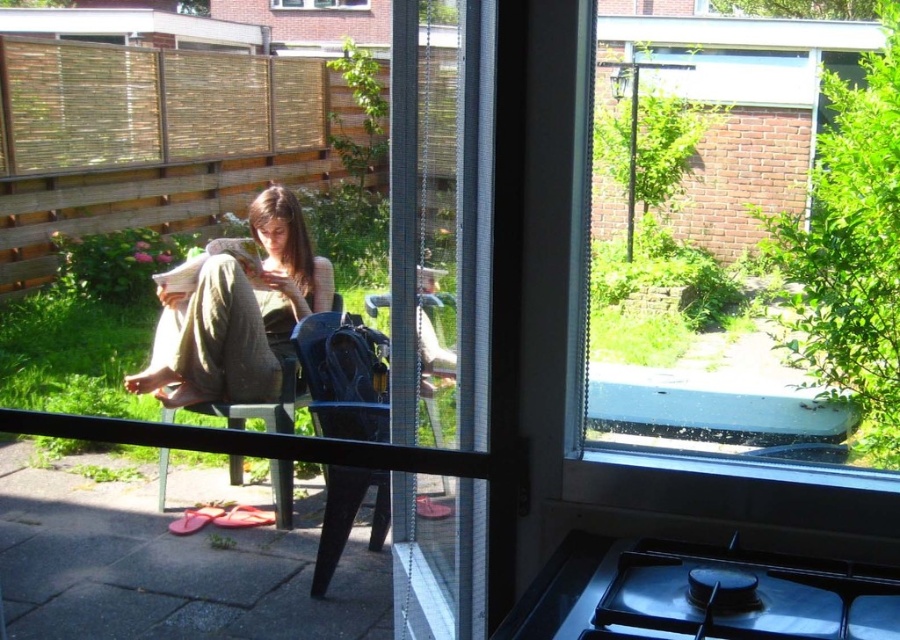
Question: Can you confirm if clear glass window at center is positioned above transparent glass window at center?

Choices:
 (A) no
 (B) yes

Answer: (A)

Question: Which point is closer to the camera?

Choices:
 (A) (320, 4)
 (B) (430, 356)
 (C) (552, 632)
 (D) (738, 428)

Answer: (C)

Question: Does black matte gas stove at lower right have a lesser width compared to matte green pants at lower left?

Choices:
 (A) yes
 (B) no

Answer: (A)

Question: Does transparent plastic screen door at center come behind wooden textured chair at lower left?

Choices:
 (A) yes
 (B) no

Answer: (B)

Question: Which point is closer to the camera?

Choices:
 (A) (438, 292)
 (B) (162, 480)
 (C) (293, 227)
 (D) (334, 6)

Answer: (A)

Question: Which point appears closest to the camera in this image?

Choices:
 (A) (315, 300)
 (B) (340, 1)
 (C) (396, 483)
 (D) (597, 387)

Answer: (C)